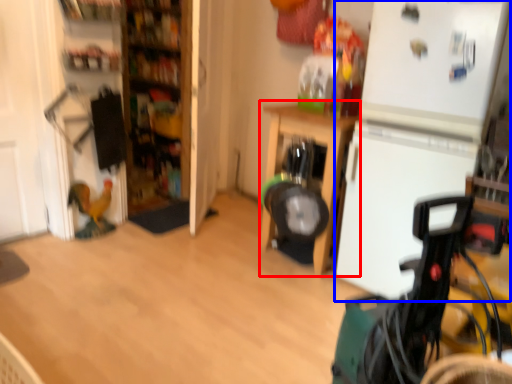
Question: Among these objects, which one is nearest to the camera, furniture (highlighted by a red box) or fridge (highlighted by a blue box)?

Choices:
 (A) furniture
 (B) fridge

Answer: (B)